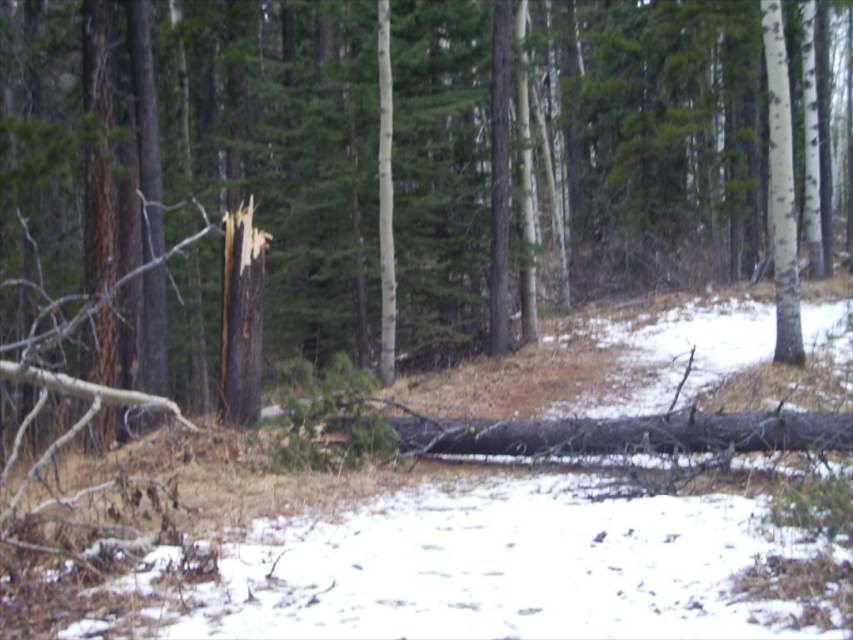
You are a hiker who wants to cross the forest path. You see dark brown bark at center and dark brown wood at center. Which one is closer to you?

The dark brown wood at center is closer to you because it is 11.39 meters away from the dark brown bark at center, so the dark brown wood at center is nearer.

From the picture: You are standing in the forest scene described. You notice a specific point marked at coordinates (657,134). What is the color of the surface at that point?

The point at (657,134) is on dark brown bark at center.